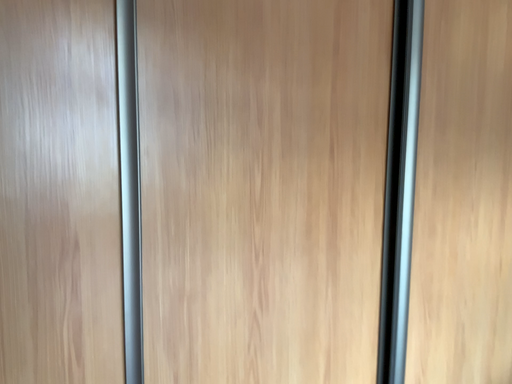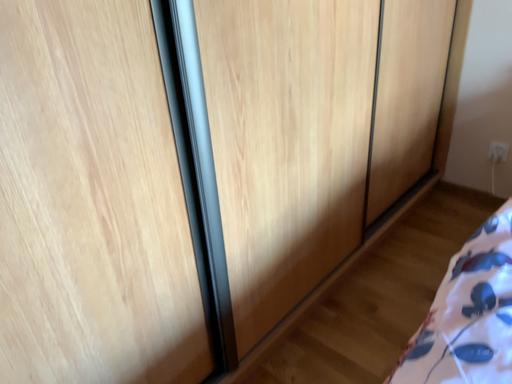
Question: Which way did the camera rotate in the video?

Choices:
 (A) rotated upward
 (B) rotated downward

Answer: (B)